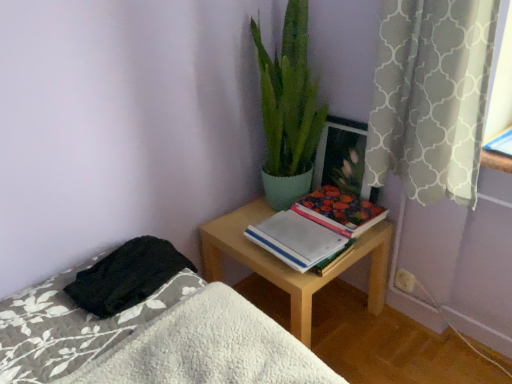
Question: Can you confirm if white paper notebook at center is smaller than green matte plant at upper center?

Choices:
 (A) no
 (B) yes

Answer: (B)

Question: Is white paper notebook at center bigger than green matte plant at upper center?

Choices:
 (A) yes
 (B) no

Answer: (B)

Question: Are white paper notebook at center and green matte plant at upper center far apart?

Choices:
 (A) no
 (B) yes

Answer: (A)

Question: From a real-world perspective, is white paper notebook at center on top of green matte plant at upper center?

Choices:
 (A) yes
 (B) no

Answer: (B)

Question: Is white paper notebook at center further to camera compared to green matte plant at upper center?

Choices:
 (A) no
 (B) yes

Answer: (B)

Question: Considering the positions of hardcover floral book at center-right and wooden picture frame at upper right in the image, is hardcover floral book at center-right taller or shorter than wooden picture frame at upper right?

Choices:
 (A) tall
 (B) short

Answer: (B)

Question: Looking at their shapes, would you say hardcover floral book at center-right is wider or thinner than wooden picture frame at upper right?

Choices:
 (A) thin
 (B) wide

Answer: (B)

Question: Would you say hardcover floral book at center-right is inside or outside wooden picture frame at upper right?

Choices:
 (A) outside
 (B) inside

Answer: (A)

Question: Considering the positions of point (310, 198) and point (335, 137), is point (310, 198) closer or farther from the camera than point (335, 137)?

Choices:
 (A) closer
 (B) farther

Answer: (B)

Question: From a real-world perspective, is white plastic electric outlet at lower right above or below hardcover floral book at center-right?

Choices:
 (A) below
 (B) above

Answer: (A)

Question: Considering the positions of white plastic electric outlet at lower right and hardcover floral book at center-right in the image, is white plastic electric outlet at lower right wider or thinner than hardcover floral book at center-right?

Choices:
 (A) wide
 (B) thin

Answer: (B)

Question: Is white plastic electric outlet at lower right in front of or behind hardcover floral book at center-right in the image?

Choices:
 (A) behind
 (B) front

Answer: (A)

Question: Is white plastic electric outlet at lower right bigger or smaller than hardcover floral book at center-right?

Choices:
 (A) small
 (B) big

Answer: (A)

Question: Looking at the image, does light wood desk at center seem bigger or smaller compared to hardcover floral book at center-right?

Choices:
 (A) small
 (B) big

Answer: (B)

Question: From the image's perspective, is light wood desk at center positioned above or below hardcover floral book at center-right?

Choices:
 (A) above
 (B) below

Answer: (B)